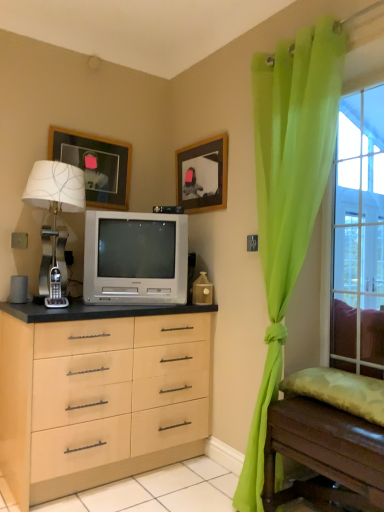
The width and height of the screenshot is (384, 512). Find the location of `vacant space situated above clear glass window at right (from a real-world perspective)`. vacant space situated above clear glass window at right (from a real-world perspective) is located at coordinates (359, 79).